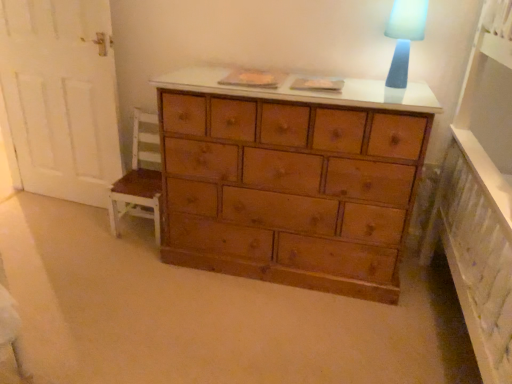
Where is `vacant area that is in front of white painted wood chair at left`? The height and width of the screenshot is (384, 512). vacant area that is in front of white painted wood chair at left is located at coordinates (124, 258).